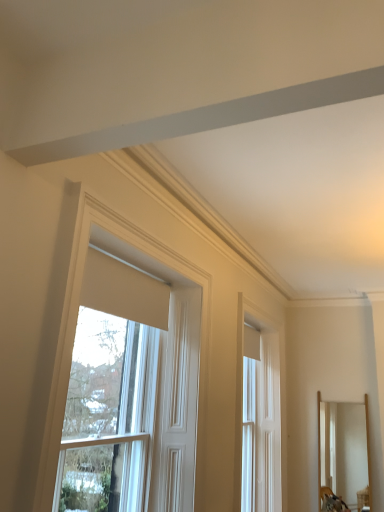
Measure the distance between wooden mirror at right and camera.

They are 5.54 meters apart.

Describe the element at coordinates (131, 386) in the screenshot. I see `white matte window at upper center, positioned as the first window in front-to-back order` at that location.

Image resolution: width=384 pixels, height=512 pixels. What do you see at coordinates (261, 410) in the screenshot? I see `white glossy door at center, which is the first window from back to front` at bounding box center [261, 410].

The width and height of the screenshot is (384, 512). Identify the location of wooden mirror at right. (343, 456).

Which object is positioned more to the right, white glossy door at center, which is the first window from back to front, or wooden mirror at right?

wooden mirror at right.

Is white glossy door at center, the 2th window positioned from the left, aimed at wooden mirror at right?

Yes, white glossy door at center, the 2th window positioned from the left, is aimed at wooden mirror at right.

Considering the sizes of objects white glossy door at center, the 2th window positioned from the left, and wooden mirror at right in the image provided, who is bigger, white glossy door at center, the 2th window positioned from the left, or wooden mirror at right?

Bigger between the two is white glossy door at center, the 2th window positioned from the left.

Is white matte window at upper center, the second window positioned from the right, next to wooden mirror at right and touching it?

No.

Could you tell me if white matte window at upper center, the second window positioned from the right, is turned towards wooden mirror at right?

No, white matte window at upper center, the second window positioned from the right, is not oriented towards wooden mirror at right.

From the image's perspective, between white matte window at upper center, arranged as the first window when viewed from the left, and wooden mirror at right, which one is located above?

From the image's view, white matte window at upper center, arranged as the first window when viewed from the left, is above.

Is point (99, 349) closer to camera compared to point (333, 510)?

Yes, it is.

From the picture: From the image's perspective, is white matte window at upper center, the second window positioned from the right, located above or below white glossy door at center, which is the 1th window from right to left?

Based on their image positions, white matte window at upper center, the second window positioned from the right, is located above white glossy door at center, which is the 1th window from right to left.

How distant is white matte window at upper center, positioned as the first window in front-to-back order, from white glossy door at center, which is the first window from back to front?

1.52 meters.

This screenshot has width=384, height=512. I want to click on window located on the left of white glossy door at center, which is the 1th window from right to left, so click(x=131, y=386).

Who is taller, white matte window at upper center, placed as the 2th window when sorted from back to front, or white glossy door at center, the 2th window positioned from the left?

Standing taller between the two is white glossy door at center, the 2th window positioned from the left.

Does wooden mirror at right have a greater width compared to white glossy door at center, which ranks as the 2th window in front-to-back order?

Indeed, wooden mirror at right has a greater width compared to white glossy door at center, which ranks as the 2th window in front-to-back order.

Is wooden mirror at right facing away from white glossy door at center, which ranks as the 2th window in front-to-back order?

No, white glossy door at center, which ranks as the 2th window in front-to-back order, is not at the back of wooden mirror at right.

Considering the positions of objects wooden mirror at right and white glossy door at center, which is the 1th window from right to left, in the image provided, who is more to the left, wooden mirror at right or white glossy door at center, which is the 1th window from right to left,?

From the viewer's perspective, white glossy door at center, which is the 1th window from right to left, appears more on the left side.

Is wooden mirror at right inside the boundaries of white glossy door at center, which is the first window from back to front, or outside?

wooden mirror at right is not enclosed by white glossy door at center, which is the first window from back to front.

Between wooden mirror at right and white matte window at upper center, arranged as the first window when viewed from the left, which one has smaller width?

With smaller width is white matte window at upper center, arranged as the first window when viewed from the left.

Is wooden mirror at right far away from white matte window at upper center, the second window positioned from the right?

Yes, wooden mirror at right and white matte window at upper center, the second window positioned from the right, are quite far apart.

Looking at this image, from a real-world perspective, is wooden mirror at right beneath white matte window at upper center, the second window positioned from the right?

Yes, from a real-world perspective, wooden mirror at right is under white matte window at upper center, the second window positioned from the right.

Considering the relative positions of white glossy door at center, which is the first window from back to front, and white matte window at upper center, placed as the 2th window when sorted from back to front, in the image provided, is white glossy door at center, which is the first window from back to front, to the right of white matte window at upper center, placed as the 2th window when sorted from back to front, from the viewer's perspective?

Yes, white glossy door at center, which is the first window from back to front, is to the right of white matte window at upper center, placed as the 2th window when sorted from back to front.

Can you tell me how much white glossy door at center, the 2th window positioned from the left, and white matte window at upper center, positioned as the first window in front-to-back order, differ in facing direction?

There is a 0.00342-degree angle between the facing directions of white glossy door at center, the 2th window positioned from the left, and white matte window at upper center, positioned as the first window in front-to-back order.

Image resolution: width=384 pixels, height=512 pixels. Identify the location of window behind the white matte window at upper center, arranged as the first window when viewed from the left. (261, 410).

Based on the photo, how far apart are white glossy door at center, which is the 1th window from right to left, and white matte window at upper center, positioned as the first window in front-to-back order?

A distance of 5.00 feet exists between white glossy door at center, which is the 1th window from right to left, and white matte window at upper center, positioned as the first window in front-to-back order.

In the image, there is a white glossy door at center, which ranks as the 2th window in front-to-back order. Where is `mirror below it (from a real-world perspective)`? mirror below it (from a real-world perspective) is located at coordinates (343, 456).

Find the location of a particular element. mirror on the right of white matte window at upper center, placed as the 2th window when sorted from back to front is located at coordinates (343, 456).

When comparing their distances from white matte window at upper center, the second window positioned from the right, does white glossy door at center, which is the first window from back to front, or wooden mirror at right seem further?

Among the two, wooden mirror at right is located further to white matte window at upper center, the second window positioned from the right.

Which object lies further to the anchor point wooden mirror at right, white matte window at upper center, positioned as the first window in front-to-back order, or white glossy door at center, the 2th window positioned from the left?

white matte window at upper center, positioned as the first window in front-to-back order.

When comparing their distances from white matte window at upper center, positioned as the first window in front-to-back order, does wooden mirror at right or white glossy door at center, which is the 1th window from right to left, seem closer?

Among the two, white glossy door at center, which is the 1th window from right to left, is located nearer to white matte window at upper center, positioned as the first window in front-to-back order.

Which object lies further to the anchor point white glossy door at center, which is the first window from back to front, wooden mirror at right or white matte window at upper center, placed as the 2th window when sorted from back to front?

Among the two, white matte window at upper center, placed as the 2th window when sorted from back to front, is located further to white glossy door at center, which is the first window from back to front.

When comparing their distances from wooden mirror at right, does white glossy door at center, which is the first window from back to front, or white matte window at upper center, arranged as the first window when viewed from the left, seem closer?

Based on the image, white glossy door at center, which is the first window from back to front, appears to be nearer to wooden mirror at right.

When comparing their distances from white glossy door at center, which is the first window from back to front, does white matte window at upper center, arranged as the first window when viewed from the left, or wooden mirror at right seem closer?

Among the two, wooden mirror at right is located nearer to white glossy door at center, which is the first window from back to front.

Identify the location of window between white matte window at upper center, positioned as the first window in front-to-back order, and wooden mirror at right, along the z-axis. The image size is (384, 512). (261, 410).